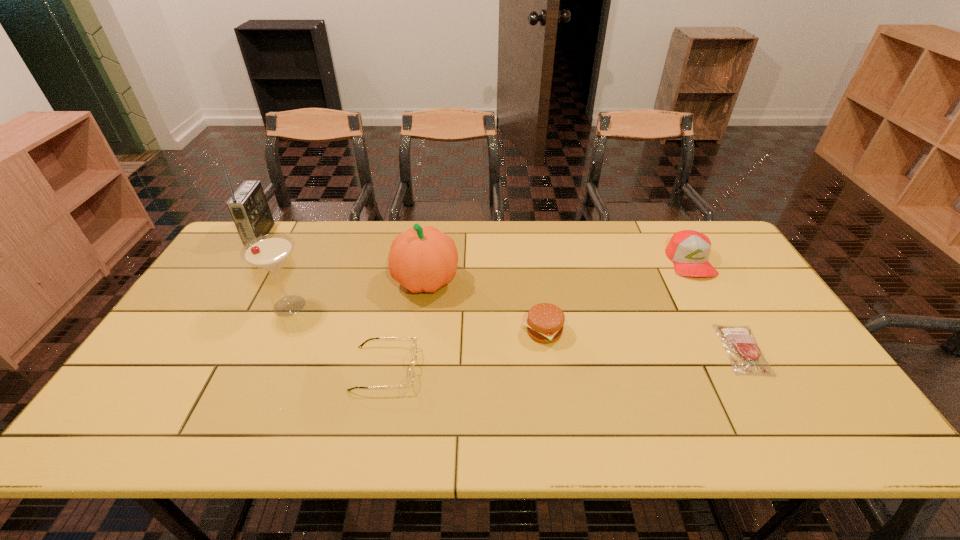
Locate an element on the screen. This screenshot has height=540, width=960. blank region between the spectacles and the second object from left to right is located at coordinates (337, 337).

This screenshot has height=540, width=960. Find the location of `empty space that is in between the baseball cap and the pumpkin`. empty space that is in between the baseball cap and the pumpkin is located at coordinates (558, 271).

At what (x,y) coordinates should I click in order to perform the action: click on blank region between the shortest object and the baseball cap. Please return your answer as a coordinate pair (x, y). The image size is (960, 540). Looking at the image, I should click on (716, 305).

This screenshot has height=540, width=960. Identify the location of free point between the pumpkin and the tallest object. (344, 258).

Where is `free space that is in between the leftmost object and the baseball cap`? free space that is in between the leftmost object and the baseball cap is located at coordinates (475, 248).

This screenshot has height=540, width=960. Find the location of `vacant area between the fourth tallest object and the leftmost object`. vacant area between the fourth tallest object and the leftmost object is located at coordinates (475, 248).

The height and width of the screenshot is (540, 960). What are the coordinates of `vacant space that's between the fourth shortest object and the fifth tallest object` in the screenshot? It's located at (617, 296).

You are a GUI agent. You are given a task and a screenshot of the screen. Output one action in this format:
    pyautogui.click(x=<x>, y=<y>)
    Task: Click on the object that can be found as the closest to the leftmost object
    
    Given the screenshot: What is the action you would take?
    pyautogui.click(x=270, y=252)

Image resolution: width=960 pixels, height=540 pixels. I want to click on object that is the closest to the sixth object from right to left, so click(411, 372).

This screenshot has height=540, width=960. Find the location of `blank area in the image that satisfies the following two spatial constraints: 1. on the display of the pumpkin; 2. on the right side of the radio receiver`. blank area in the image that satisfies the following two spatial constraints: 1. on the display of the pumpkin; 2. on the right side of the radio receiver is located at coordinates (231, 281).